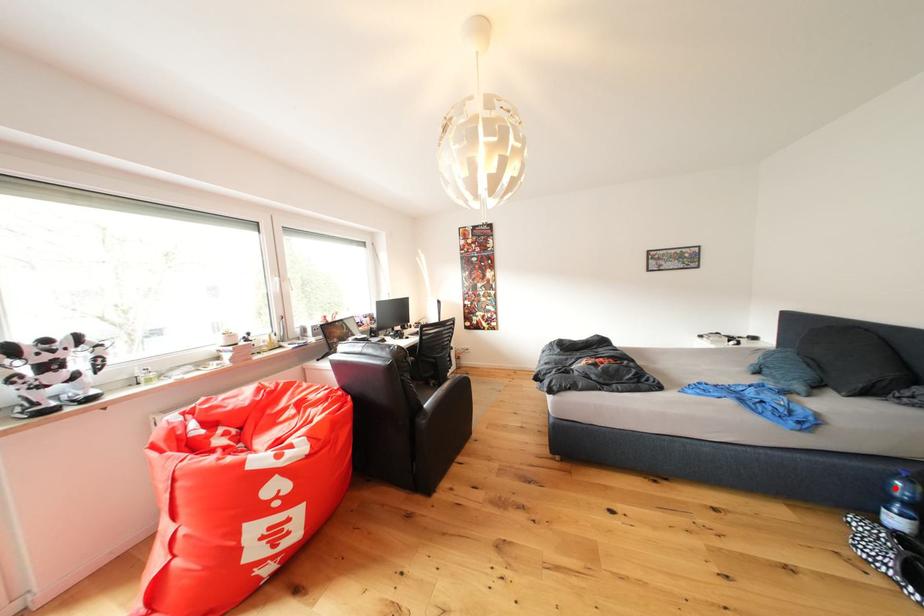
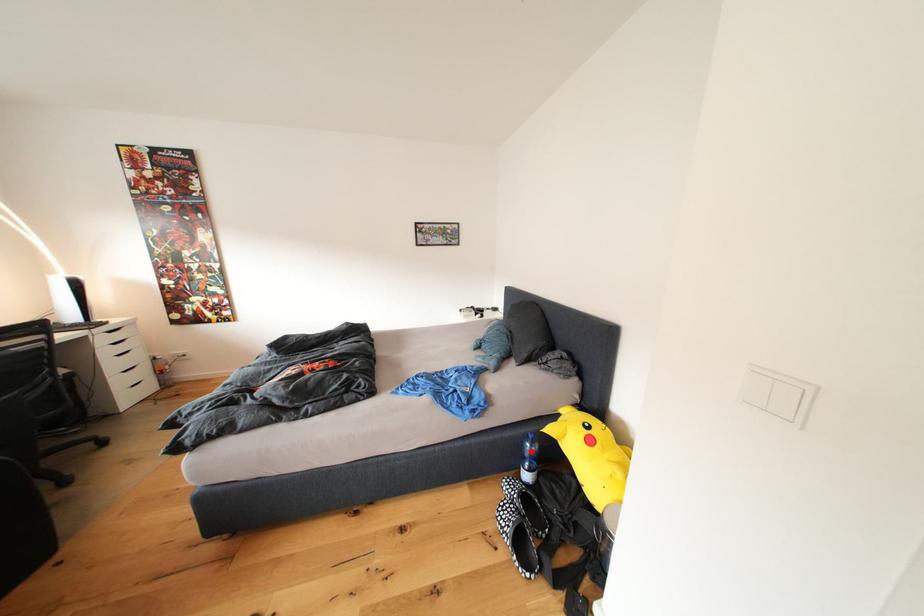
I am providing you with two images of the same scene from different viewpoints. A red point is marked on the first image and another point is marked on the second image. Does the point marked in image1 correspond to the same location as the one in image2?

Yes